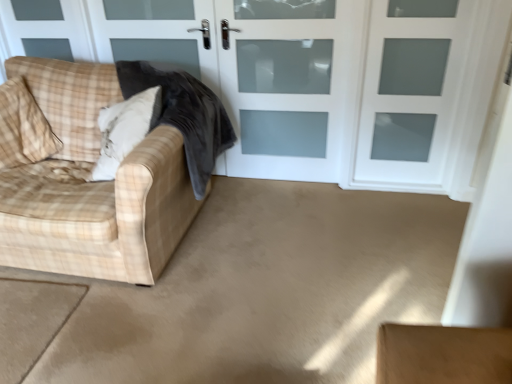
Image resolution: width=512 pixels, height=384 pixels. I want to click on vacant area that is in front of white frosted glass screen door at upper center, which is counted as the 1th screen door, starting from the right, so pos(409,218).